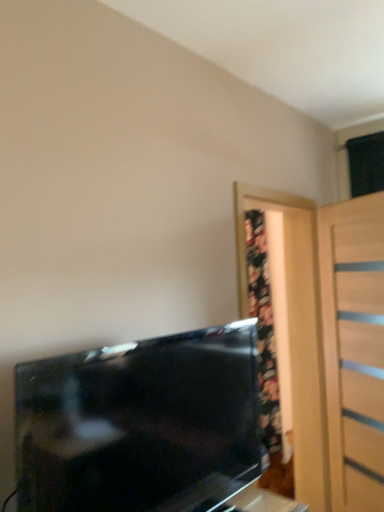
The image size is (384, 512). I want to click on black glossy tv at lower left, so click(140, 424).

In order to face black glossy tv at lower left, should I rotate leftwards or rightwards?

Rotate your view left by about 2.322°.

Where is `matte black tv at lower left`? Image resolution: width=384 pixels, height=512 pixels. matte black tv at lower left is located at coordinates click(x=261, y=502).

Based on their sizes in the image, would you say matte black tv at lower left is bigger or smaller than light wood door at right?

Clearly, matte black tv at lower left is smaller in size than light wood door at right.

Is matte black tv at lower left far away from light wood door at right?

No, matte black tv at lower left is not far away from light wood door at right.

Is matte black tv at lower left aimed at light wood door at right?

Yes, matte black tv at lower left is aimed at light wood door at right.

From the image's perspective, which is above, light wood door at right or black glossy tv at lower left?

black glossy tv at lower left, from the image's perspective.

Is black glossy tv at lower left a part of light wood door at right?

No, black glossy tv at lower left is not surrounded by light wood door at right.

Between light wood door at right and black glossy tv at lower left, which one has less height?

black glossy tv at lower left.

How far apart are light wood door at right and black glossy tv at lower left?

1.43 meters.

Which object is wider, light wood door at right or matte black tv at lower left?

Wider between the two is matte black tv at lower left.

Is light wood door at right positioned beyond the bounds of matte black tv at lower left?

Absolutely, light wood door at right is external to matte black tv at lower left.

Consider the image. Is light wood door at right closer to camera compared to matte black tv at lower left?

No.

Identify the location of door behind the black glossy tv at lower left. [354, 348].

Do you think black glossy tv at lower left is within light wood door at right, or outside of it?

black glossy tv at lower left is spatially situated outside light wood door at right.

Is black glossy tv at lower left oriented away from light wood door at right?

No, black glossy tv at lower left is not facing away from light wood door at right.

Considering the relative sizes of black glossy tv at lower left and light wood door at right in the image provided, is black glossy tv at lower left bigger than light wood door at right?

Incorrect, black glossy tv at lower left is not larger than light wood door at right.

Considering the relative sizes of matte black tv at lower left and black glossy tv at lower left in the image provided, is matte black tv at lower left shorter than black glossy tv at lower left?

Correct, matte black tv at lower left is not as tall as black glossy tv at lower left.

Between matte black tv at lower left and black glossy tv at lower left, which one has larger size?

black glossy tv at lower left.

Looking at this image, is matte black tv at lower left aimed at black glossy tv at lower left?

No, matte black tv at lower left is not turned towards black glossy tv at lower left.

Locate an element on the screen. This screenshot has height=512, width=384. table that appears below the black glossy tv at lower left (from the image's perspective) is located at coordinates (261, 502).

Considering the positions of point (251, 467) and point (243, 498), is point (251, 467) closer or farther from the camera than point (243, 498)?

Point (251, 467).

Considering the relative sizes of black glossy tv at lower left and matte black tv at lower left in the image provided, is black glossy tv at lower left thinner than matte black tv at lower left?

In fact, black glossy tv at lower left might be wider than matte black tv at lower left.

Which of these two, black glossy tv at lower left or matte black tv at lower left, is smaller?

With smaller size is matte black tv at lower left.

Is black glossy tv at lower left positioned far away from matte black tv at lower left?

Yes.

Identify the location of door that appears behind the matte black tv at lower left. The image size is (384, 512). (x=354, y=348).

You are a GUI agent. You are given a task and a screenshot of the screen. Output one action in this format:
    pyautogui.click(x=<x>, y=<y>)
    Task: Click on the television in front of the light wood door at right
    The height and width of the screenshot is (512, 384).
    Given the screenshot: What is the action you would take?
    pyautogui.click(x=140, y=424)

From the image, which object appears to be nearer to light wood door at right, black glossy tv at lower left or matte black tv at lower left?

Based on the image, matte black tv at lower left appears to be nearer to light wood door at right.

From the image, which object appears to be nearer to matte black tv at lower left, black glossy tv at lower left or light wood door at right?

light wood door at right lies closer to matte black tv at lower left than the other object.

Considering their positions, is light wood door at right positioned closer to matte black tv at lower left than black glossy tv at lower left?

light wood door at right.

Estimate the real-world distances between objects in this image. Which object is further from light wood door at right, matte black tv at lower left or black glossy tv at lower left?

black glossy tv at lower left.

When comparing their distances from black glossy tv at lower left, does matte black tv at lower left or light wood door at right seem closer?

The object closer to black glossy tv at lower left is light wood door at right.

Estimate the real-world distances between objects in this image. Which object is further from black glossy tv at lower left, light wood door at right or matte black tv at lower left?

matte black tv at lower left.

In order to click on table positioned between black glossy tv at lower left and light wood door at right from near to far in this screenshot , I will do `click(261, 502)`.